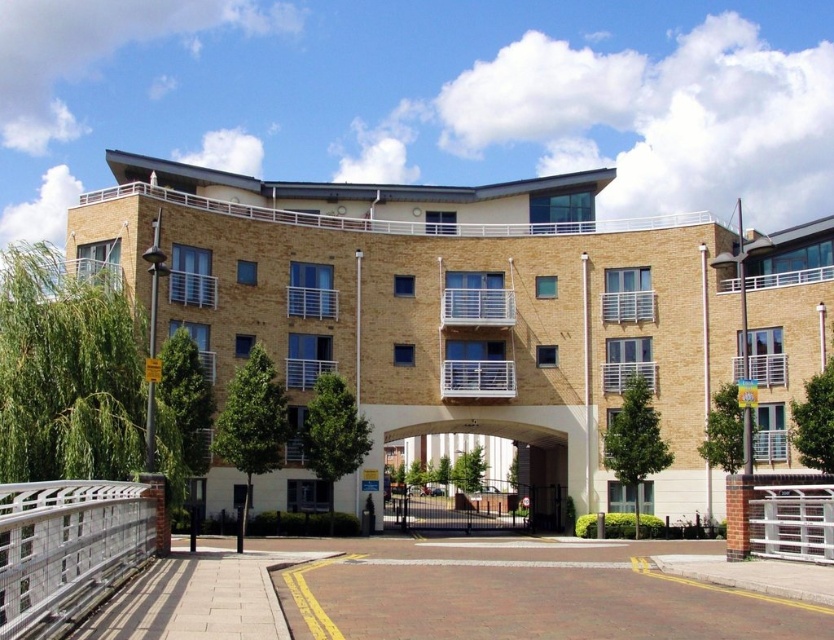
Does beige brick building at center have a smaller size compared to silver metallic rail at lower left?

Actually, beige brick building at center might be larger than silver metallic rail at lower left.

Based on the photo, who is positioned more to the left, beige brick building at center or silver metallic rail at lower left?

Positioned to the left is silver metallic rail at lower left.

The image size is (834, 640). Describe the element at coordinates (476, 307) in the screenshot. I see `beige brick building at center` at that location.

Identify the location of beige brick building at center. (476, 307).